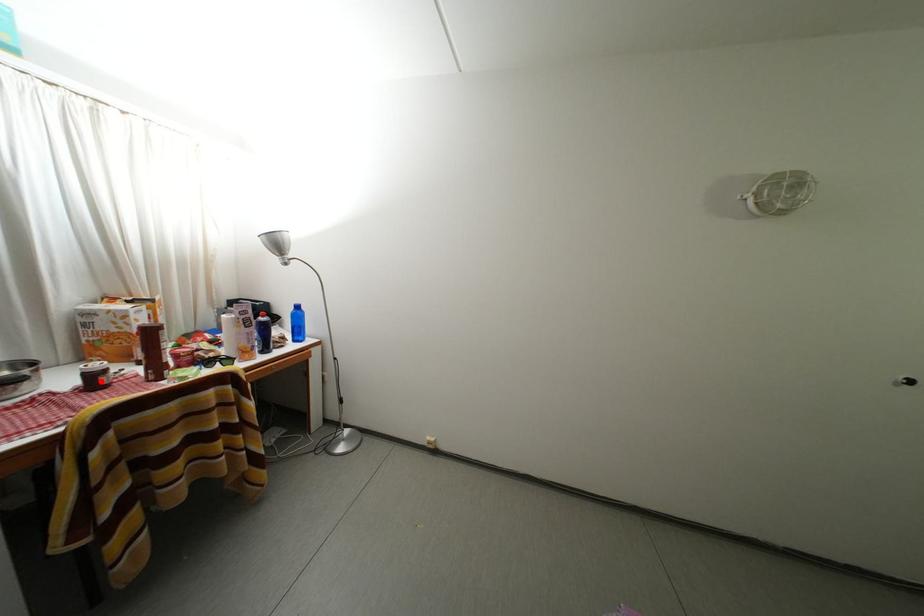
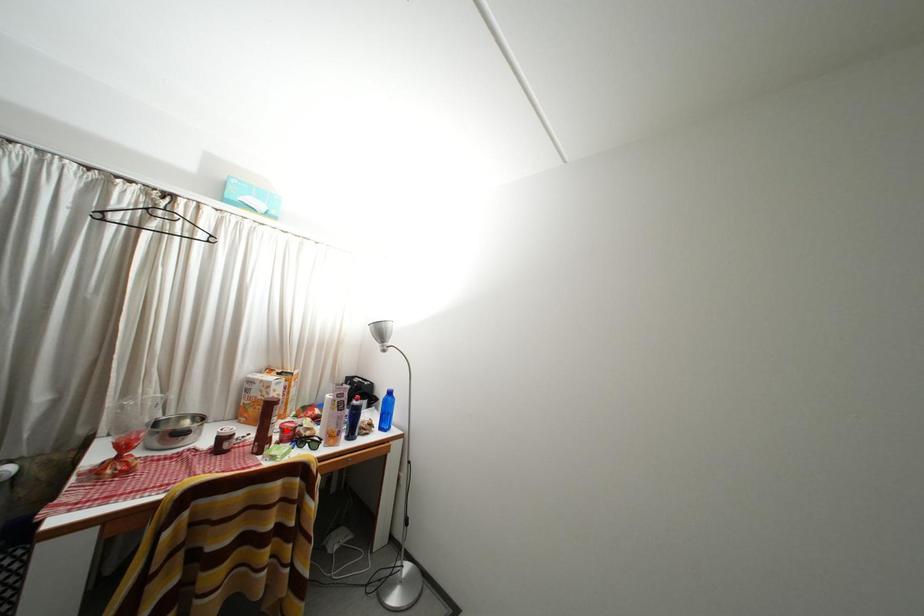
I am providing you with two images of the same scene from different viewpoints. A red point is marked on the first image and another point is marked on the second image. Do the highlighted points in image1 and image2 indicate the same real-world spot?

No